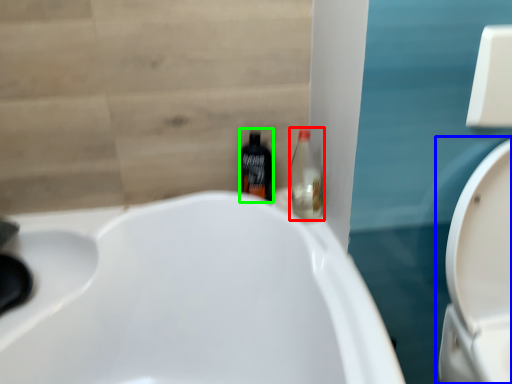
Question: Which is nearer to the bottle (highlighted by a red box)? toilet (highlighted by a blue box) or bottle (highlighted by a green box).

Choices:
 (A) toilet
 (B) bottle

Answer: (B)